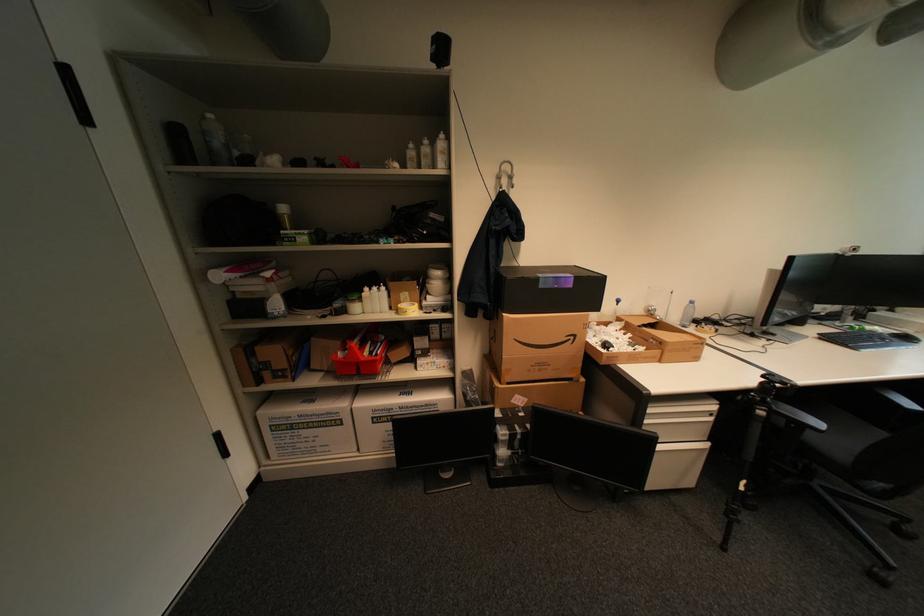
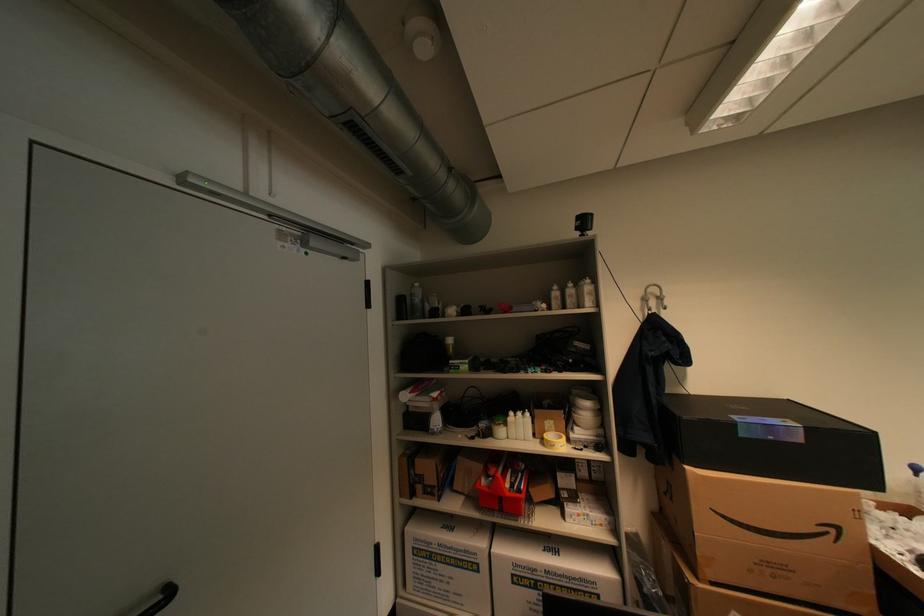
Find the pixel in the second image that matches (371,360) in the first image.

(516, 495)